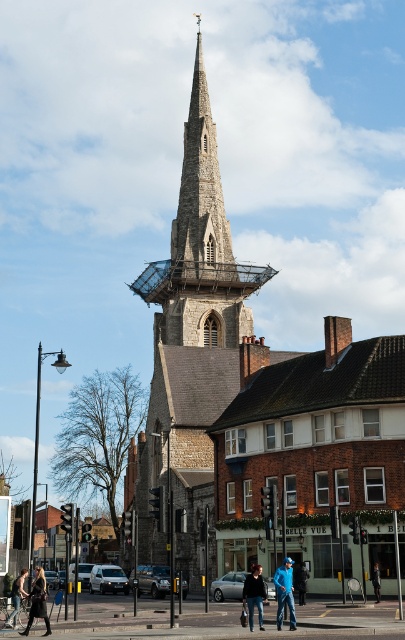
Measure the distance between blue denim jeans at center and black leather jacket at lower left.

The distance of blue denim jeans at center from black leather jacket at lower left is 30.80 feet.

Who is more distant from viewer, (285,580) or (29,593)?

The point (29,593) is behind.

Is point (291, 600) positioned behind point (25, 634)?

That is False.

Find the location of `blue denim jeans at center`. blue denim jeans at center is located at coordinates (285, 592).

Does stone steeple at center have a greater width compared to denim jacket at lower left?

Correct, the width of stone steeple at center exceeds that of denim jacket at lower left.

Is point (200, 45) closer to viewer compared to point (21, 570)?

No, it is behind (21, 570).

This screenshot has width=405, height=640. Identify the location of stone steeple at center. (200, 244).

Is black leather jacket at lower left smaller than denim jacket at center?

Incorrect, black leather jacket at lower left is not smaller in size than denim jacket at center.

Does black leather jacket at lower left appear under denim jacket at center?

Actually, black leather jacket at lower left is above denim jacket at center.

Does point (44, 593) come farther from viewer compared to point (377, 570)?

No, it is in front of (377, 570).

I want to click on black leather jacket at lower left, so click(38, 602).